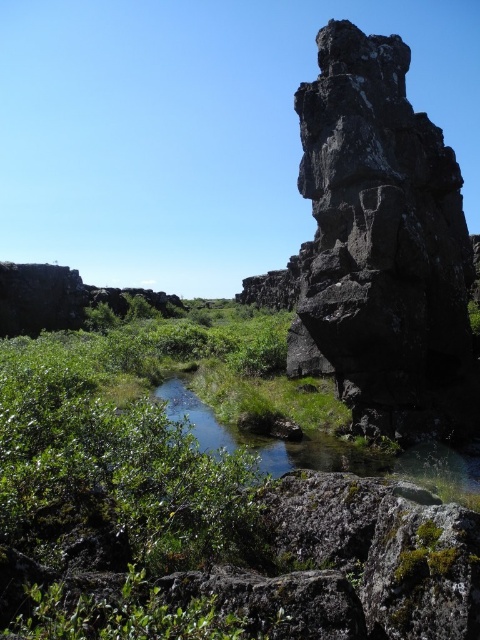
Can you confirm if green leafy shrubs at center is thinner than black rough rock at right?

No.

Does green leafy shrubs at center lie behind black rough rock at right?

That is False.

Does point (252, 449) come behind point (388, 385)?

No, it is not.

Where is `green leafy shrubs at center`? green leafy shrubs at center is located at coordinates (213, 506).